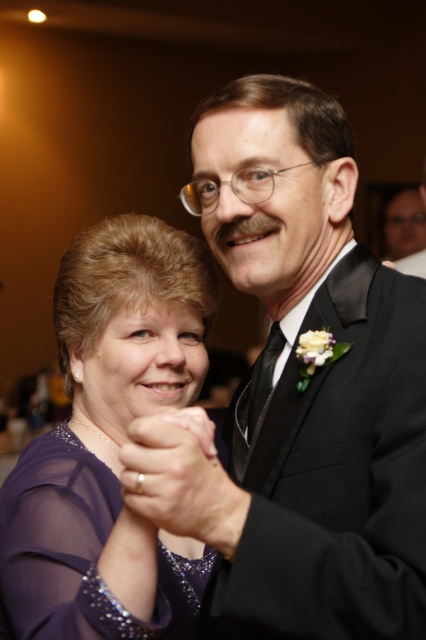
You are a photographer standing at the center of the dance floor. You want to take a photo of the purple sheer dress at lower left. Which direction should you move to get a better shot?

The purple sheer dress at lower left is located at point (109, 444), so you should move towards the lower left direction to get a better shot.

You are a photographer at the event and need to capture both the purple sheer dress at lower left and the purple sheer dress at center in a single frame. Which dress should you focus on to ensure the wider one is properly framed?

The purple sheer dress at center is wider than the purple sheer dress at lower left, so you should focus on the purple sheer dress at center to ensure the wider one is properly framed.

In the scene of a formal event, there are two purple sheer dresses present. One is located at the lower left and the other at the center. From the perspective of someone standing at the center of the image, which direction would the purple sheer dress at lower left be relative to the purple sheer dress at center?

The purple sheer dress at lower left is to the right of the purple sheer dress at center from the perspective of someone standing at the center of the image.